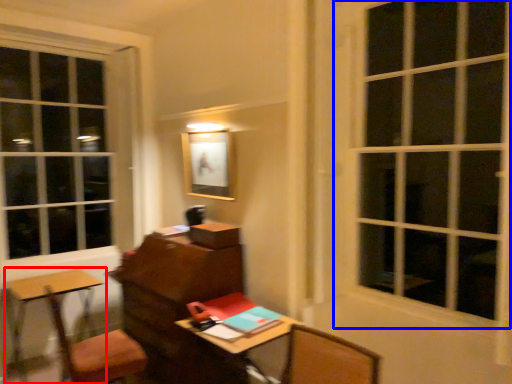
Question: Which point is further to the camera, table (highlighted by a red box) or window (highlighted by a blue box)?

Choices:
 (A) table
 (B) window

Answer: (A)